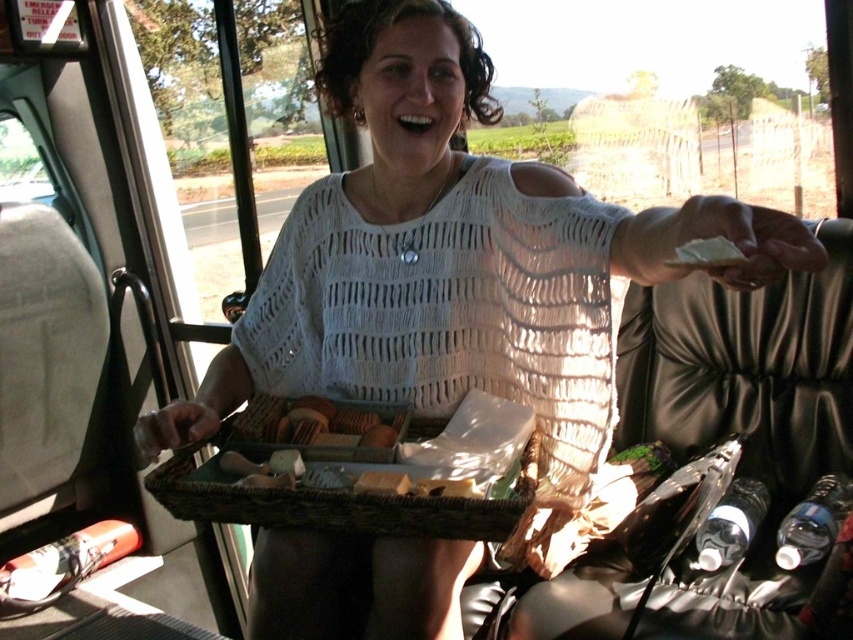
Question: Which object appears farthest from the camera in this image?

Choices:
 (A) white matte bread at upper right
 (B) woven brown basket at center

Answer: (B)

Question: Which of the following is the closest to the observer?

Choices:
 (A) (701, 250)
 (B) (229, 496)

Answer: (A)

Question: Is woven brown basket at center smaller than white matte bread at upper right?

Choices:
 (A) no
 (B) yes

Answer: (A)

Question: Which point appears farthest from the camera in this image?

Choices:
 (A) (666, 260)
 (B) (461, 515)

Answer: (B)

Question: Does woven brown basket at center appear over white matte bread at upper right?

Choices:
 (A) no
 (B) yes

Answer: (A)

Question: Where is woven brown basket at center located in relation to white matte bread at upper right in the image?

Choices:
 (A) left
 (B) right

Answer: (A)